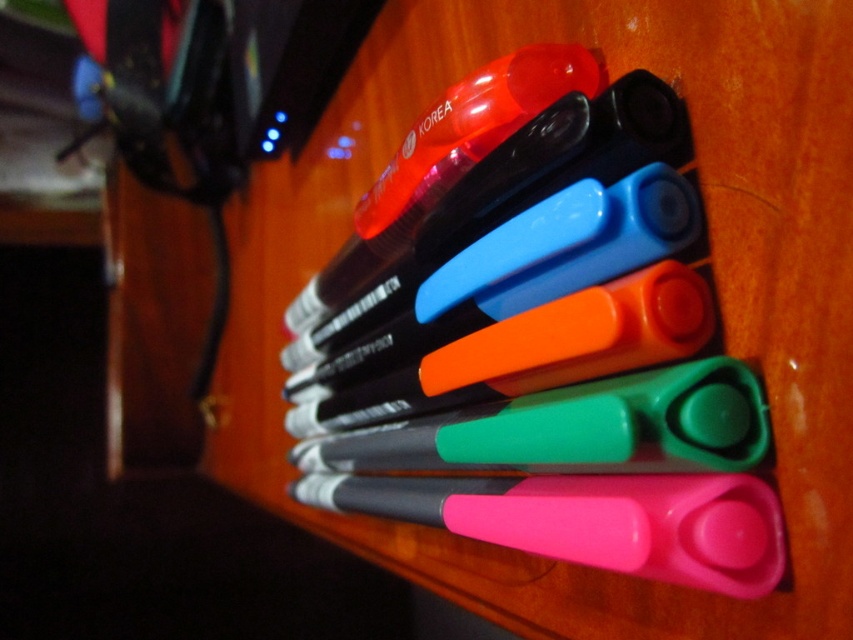
Question: Where is translucent plastic highlighter at upper center located in relation to pink plastic scissors at center in the image?

Choices:
 (A) left
 (B) right

Answer: (A)

Question: Is translucent plastic highlighter at upper center positioned behind pink plastic scissors at center?

Choices:
 (A) no
 (B) yes

Answer: (B)

Question: Which point is closer to the camera?

Choices:
 (A) (496, 70)
 (B) (727, 509)
 (C) (494, 464)

Answer: (B)

Question: Which point is closer to the camera?

Choices:
 (A) pink plastic scissors at center
 (B) translucent plastic highlighter at upper center

Answer: (A)

Question: Is translucent plastic highlighter at upper center in front of pink plastic scissors at center?

Choices:
 (A) yes
 (B) no

Answer: (B)

Question: Among these points, which one is farthest from the camera?

Choices:
 (A) (358, 509)
 (B) (325, 436)
 (C) (328, 502)

Answer: (B)